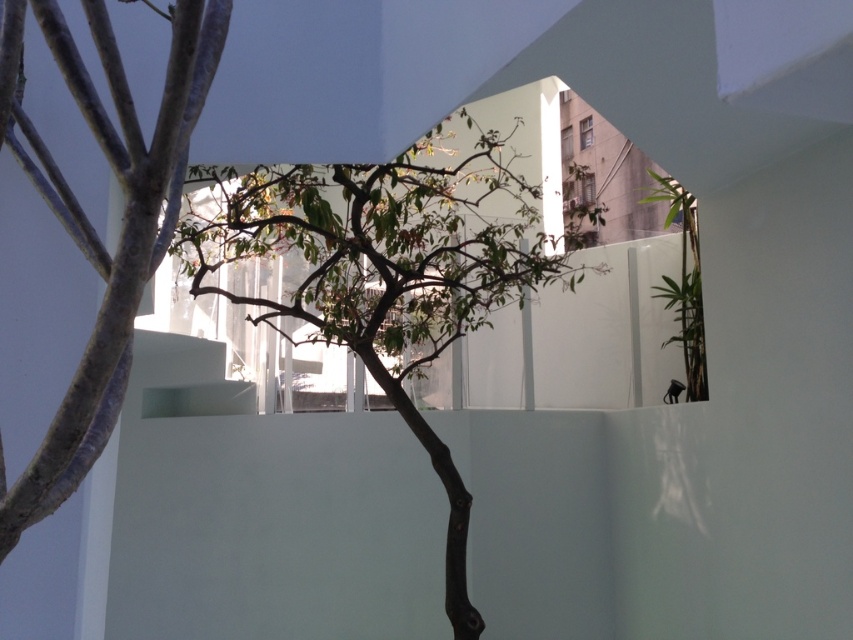
Question: Can you confirm if green leafy tree at left is wider than green leafy plant at right?

Choices:
 (A) no
 (B) yes

Answer: (B)

Question: Is green leafy tree at center thinner than green leafy plant at right?

Choices:
 (A) yes
 (B) no

Answer: (B)

Question: Which is nearer to the green leafy tree at center?

Choices:
 (A) green leafy plant at right
 (B) green leafy tree at left

Answer: (A)

Question: Which is farther from the green leafy tree at center?

Choices:
 (A) green leafy tree at left
 (B) green leafy plant at right

Answer: (A)

Question: Can you confirm if green leafy tree at left is bigger than green leafy plant at right?

Choices:
 (A) no
 (B) yes

Answer: (B)

Question: Which point is closer to the camera?

Choices:
 (A) green leafy plant at right
 (B) green leafy tree at left
 (C) green leafy tree at center

Answer: (B)